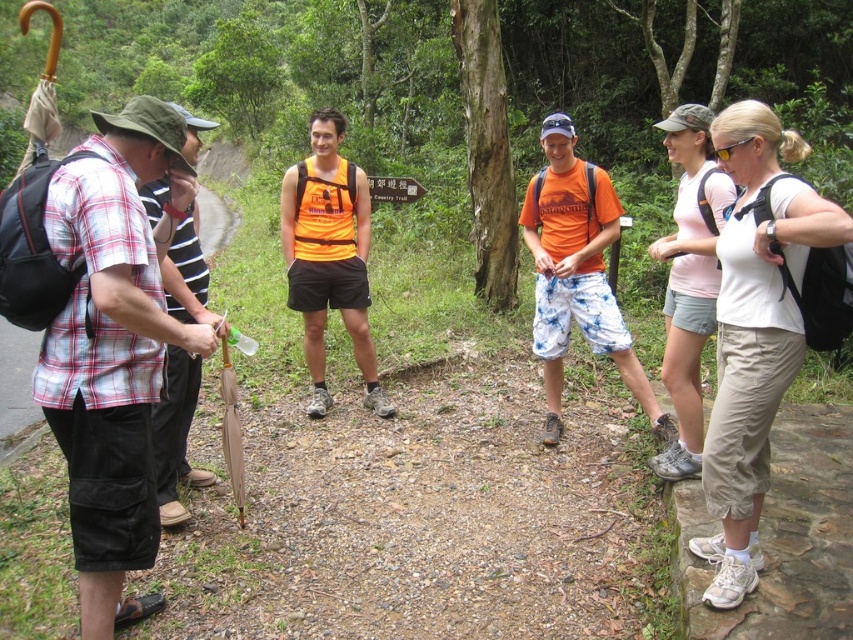
Question: Can you confirm if orange cotton shirt at center is positioned below orange matte vest at center?

Choices:
 (A) no
 (B) yes

Answer: (B)

Question: Which object is farther from the camera taking this photo?

Choices:
 (A) plaid fabric shirt at left
 (B) light beige capri pants at right
 (C) brown leather umbrella at lower left
 (D) plaid cotton shirt at left

Answer: (C)

Question: Can you confirm if orange cotton shirt at center is positioned to the left of plaid fabric shirt at left?

Choices:
 (A) no
 (B) yes

Answer: (A)

Question: Is light beige capri pants at right positioned at the back of orange matte vest at center?

Choices:
 (A) yes
 (B) no

Answer: (B)

Question: Which object is positioned closest to the brown leather umbrella at lower left?

Choices:
 (A) light beige capri pants at right
 (B) orange cotton shirt at center
 (C) plaid cotton shirt at left
 (D) pink fabric shorts at upper right

Answer: (C)

Question: Which object is farther from the camera taking this photo?

Choices:
 (A) plaid cotton shirt at left
 (B) plaid fabric shirt at left
 (C) light beige capri pants at right
 (D) orange cotton shirt at center

Answer: (D)